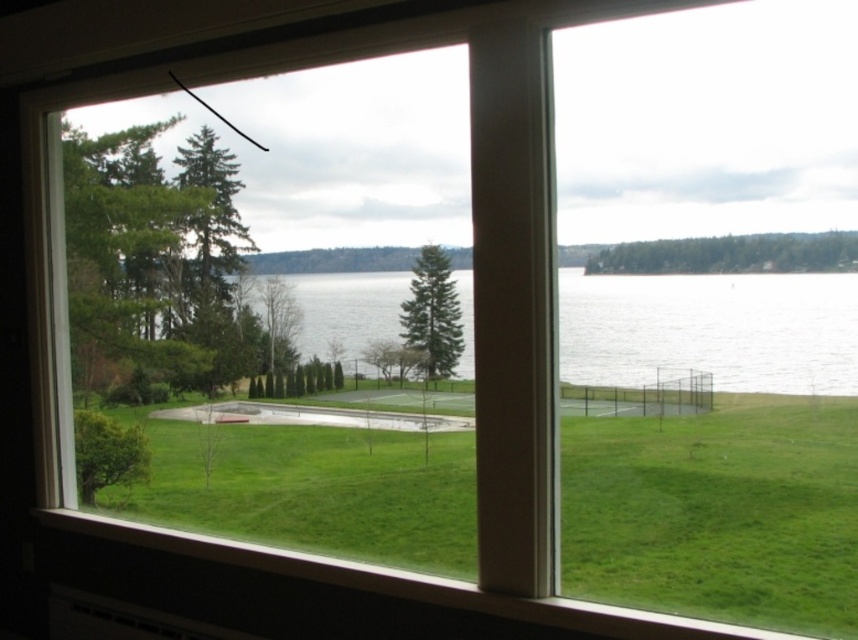
Question: Can you confirm if green grassy at lower left is positioned above clear water at center?

Choices:
 (A) yes
 (B) no

Answer: (B)

Question: Which point is farther to the camera?

Choices:
 (A) clear water at center
 (B) green grassy at lower left

Answer: (B)

Question: Is green grassy at lower left behind clear water at center?

Choices:
 (A) no
 (B) yes

Answer: (B)

Question: Can you confirm if green grassy at lower left is smaller than clear water at center?

Choices:
 (A) yes
 (B) no

Answer: (A)